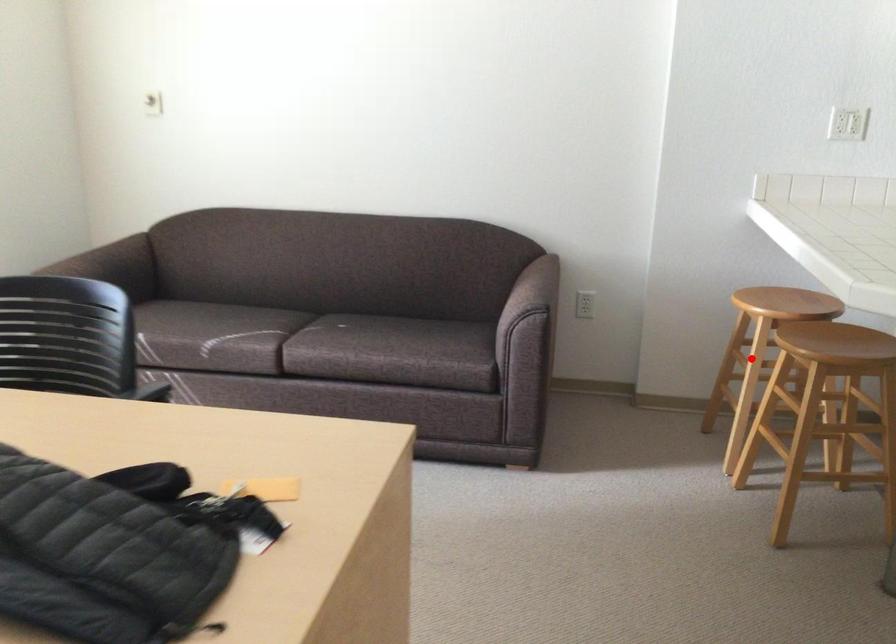
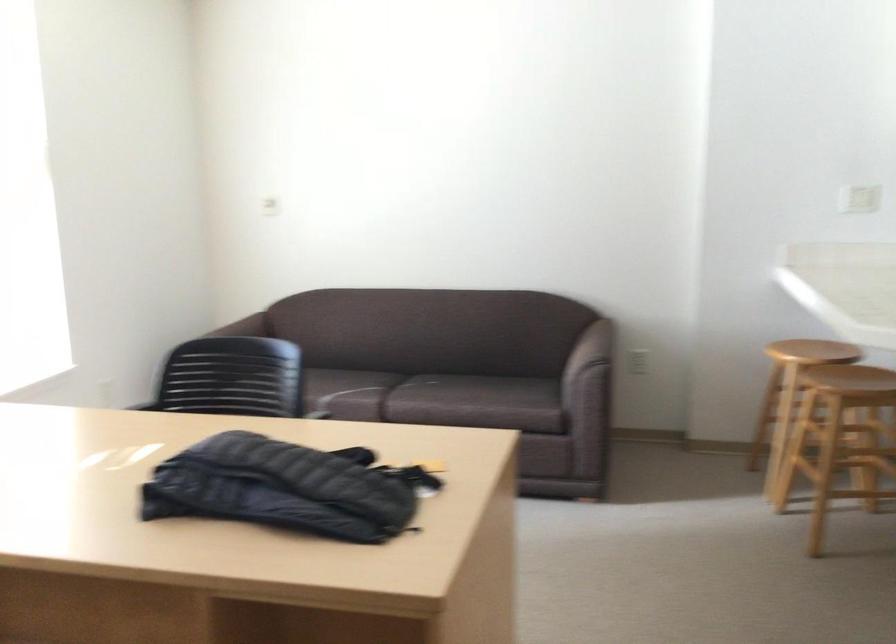
Question: I am providing you with two images of the same scene from different viewpoints. In image1, a red point is highlighted. Considering the same 3D point in image2, which of the following is correct?

Choices:
 (A) It is closer
 (B) It is farther

Answer: (B)